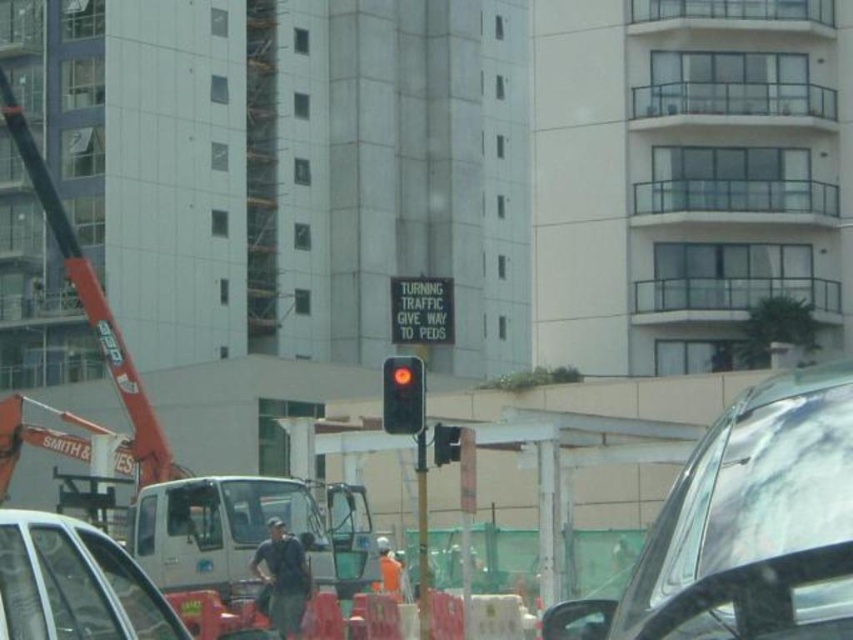
Question: Does matte black traffic light at center have a greater width compared to orange fabric man at center?

Choices:
 (A) no
 (B) yes

Answer: (B)

Question: Which of the following is the closest to the observer?

Choices:
 (A) shiny silver car at center
 (B) orange fabric man at center
 (C) matte black car at lower left

Answer: (A)

Question: Which point is farther to the camera?

Choices:
 (A) (387, 550)
 (B) (457, 445)

Answer: (A)

Question: Does shiny silver car at center appear on the left side of black glass traffic light at center?

Choices:
 (A) yes
 (B) no

Answer: (B)

Question: Which object appears closest to the camera in this image?

Choices:
 (A) matte black car at lower left
 (B) matte black traffic light at center
 (C) orange fabric man at center

Answer: (A)

Question: Does shiny silver car at center appear on the left side of orange fabric man at center?

Choices:
 (A) no
 (B) yes

Answer: (A)